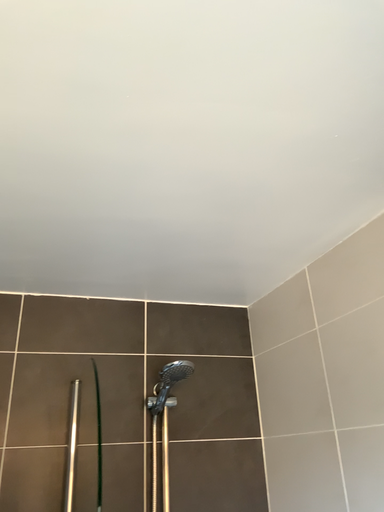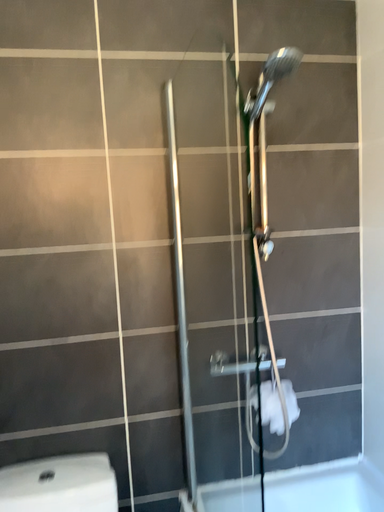
Question: How did the camera likely rotate when shooting the video?

Choices:
 (A) rotated upward
 (B) rotated downward

Answer: (B)